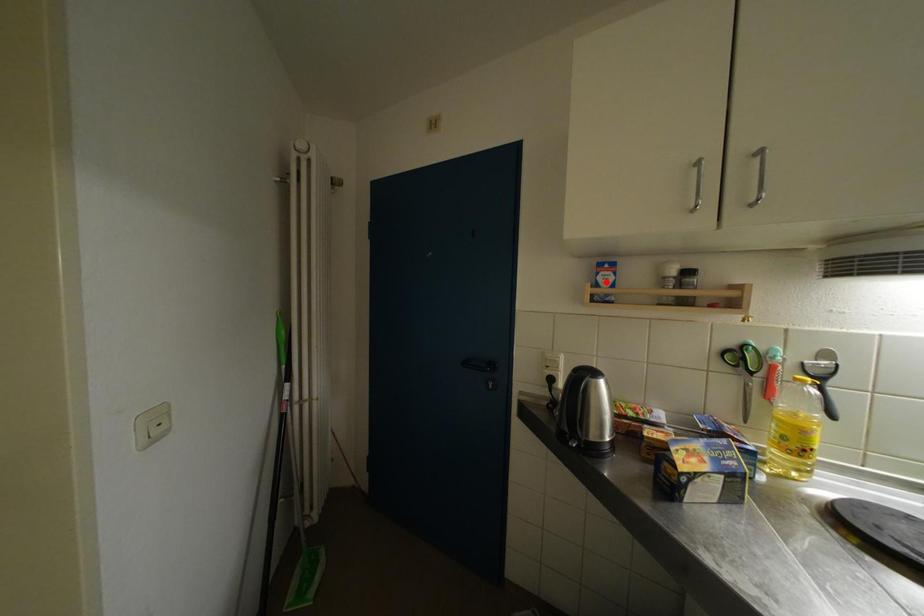
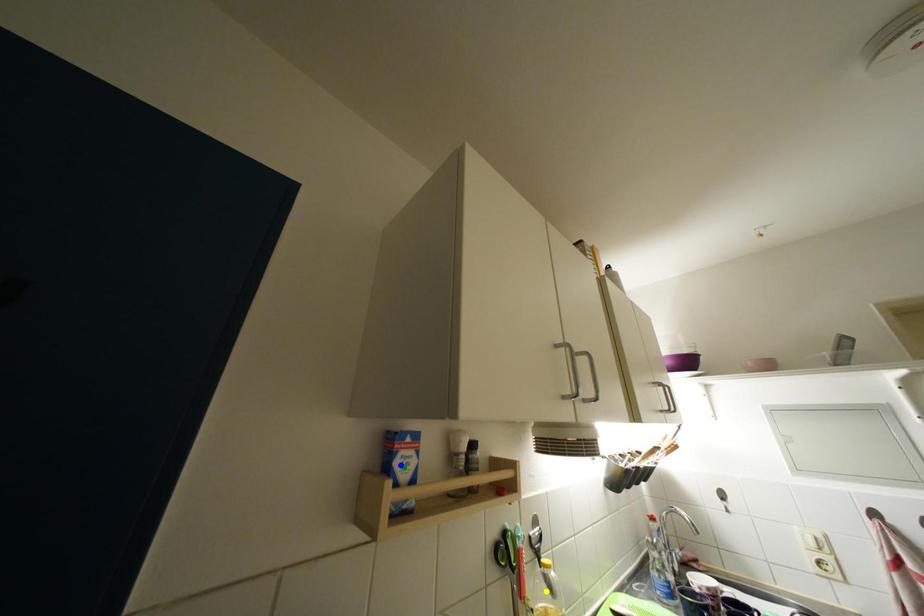
Question: I am providing you with two images of the same scene from different viewpoints. A red point is marked on the first image. You are given multiple points on the second image. Which point in image 2 is actually the same real-world point as the red point in image 1?

Choices:
 (A) green point
 (B) yellow point
 (C) blue point

Answer: (A)